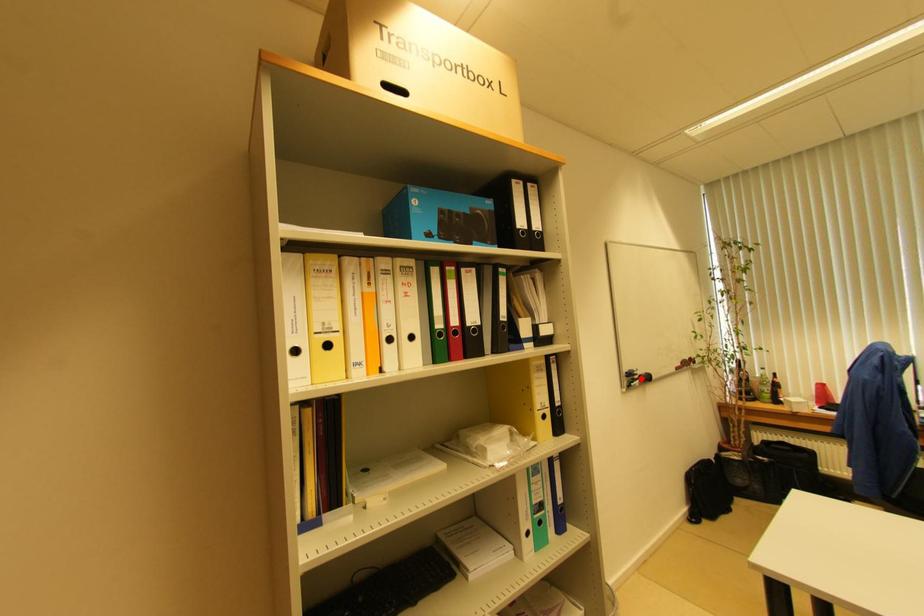
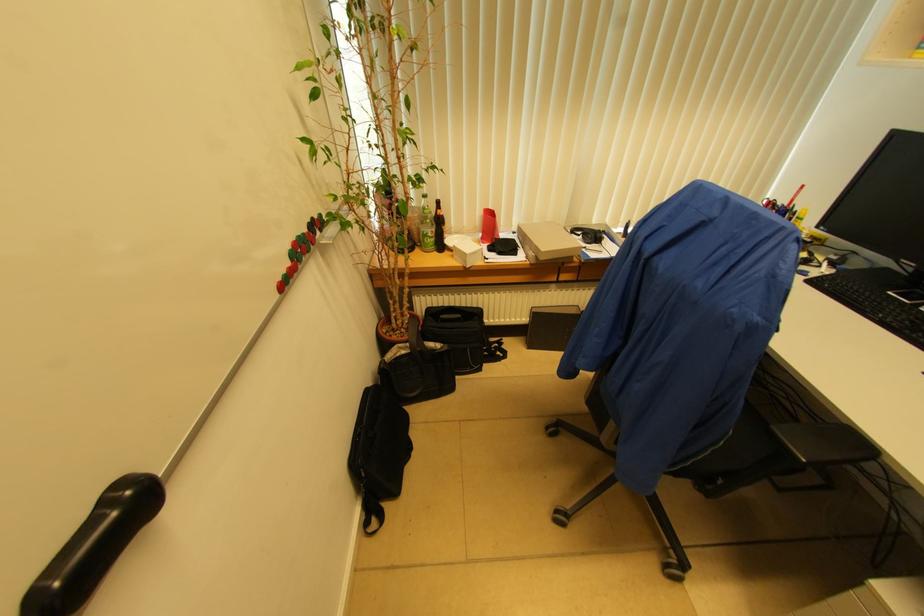
The point at the highlighted location is marked in the first image. Where is the corresponding point in the second image?

(35, 600)